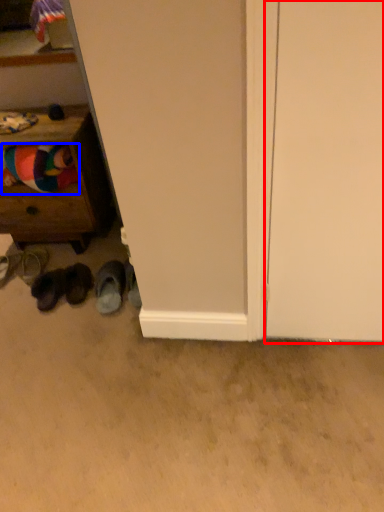
Question: Which of the following is the farthest to the observer, door (highlighted by a red box) or clothing (highlighted by a blue box)?

Choices:
 (A) door
 (B) clothing

Answer: (B)